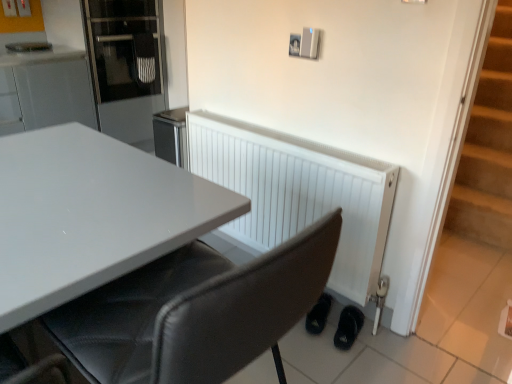
Question: In the image, is black leather chair at center on the left side or the right side of black leather shoes at lower right, which is the second footwear from left to right?

Choices:
 (A) left
 (B) right

Answer: (A)

Question: Relative to black leather shoes at lower right, which is the second footwear from left to right, is black leather chair at center in front or behind?

Choices:
 (A) behind
 (B) front

Answer: (B)

Question: Which object is positioned closest to the glass door refrigerator at upper left?

Choices:
 (A) black leather shoes at lower right, the 2th footwear from the right
 (B) black leather chair at center
 (C) white matte radiator at lower right
 (D) black leather shoes at lower right, which is the second footwear from left to right

Answer: (C)

Question: Which of these objects is positioned farthest from the black leather shoes at lower right, the 2th footwear from the right?

Choices:
 (A) white matte radiator at lower right
 (B) glass door refrigerator at upper left
 (C) black leather shoes at lower right, which is the second footwear from left to right
 (D) black leather chair at center

Answer: (B)